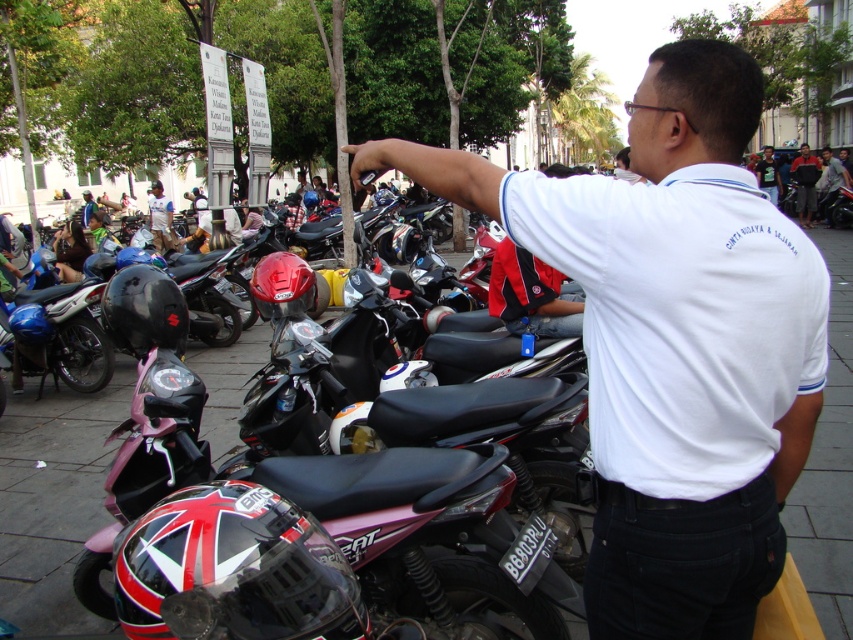
Is white smooth shirt at center wider than reddish-brown leather jacket at upper right?

Indeed, white smooth shirt at center has a greater width compared to reddish-brown leather jacket at upper right.

Who is more distant from viewer, (694, 300) or (811, 196)?

Point (811, 196)

Identify the location of white smooth shirt at center. (672, 342).

Image resolution: width=853 pixels, height=640 pixels. What are the coordinates of `white smooth shirt at center` in the screenshot? It's located at (672, 342).

Is pink matte scooter at center thinner than white shirt at upper center?

Indeed, pink matte scooter at center has a lesser width compared to white shirt at upper center.

Between point (531, 577) and point (763, 147), which one is positioned in front?

Point (531, 577) is more forward.

Where is `pink matte scooter at center`? pink matte scooter at center is located at coordinates (426, 532).

Can you confirm if light gray fabric shirt at center is smaller than white shirt at upper center?

Correct, light gray fabric shirt at center occupies less space than white shirt at upper center.

Which is more to the left, light gray fabric shirt at center or white shirt at upper center?

white shirt at upper center

Is point (833, 225) positioned behind point (767, 189)?

No, (833, 225) is closer to viewer.

Identify the location of light gray fabric shirt at center. (831, 182).